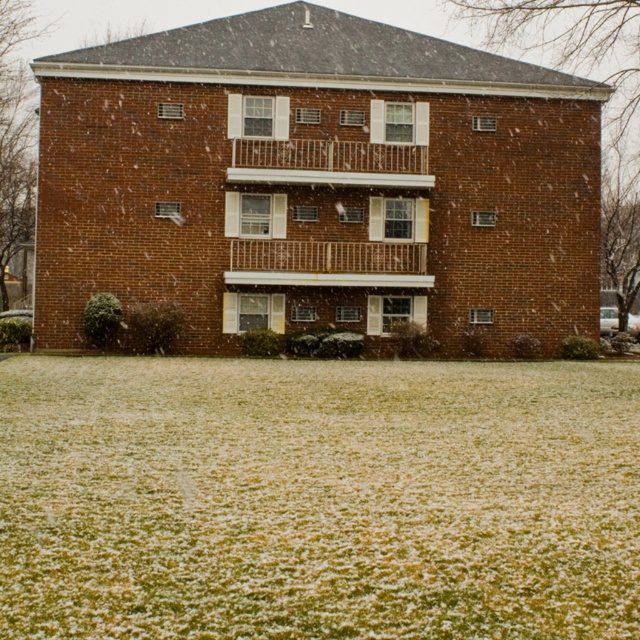
Which is more to the left, green grass at lower center or white metal railing at upper center?

green grass at lower center

Does point (186, 417) lie in front of point (404, 150)?

Yes, point (186, 417) is closer to viewer.

Where is `green grass at lower center`? Image resolution: width=640 pixels, height=640 pixels. green grass at lower center is located at coordinates (317, 499).